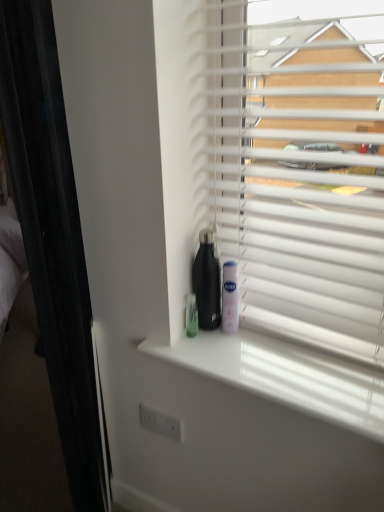
This screenshot has height=512, width=384. I want to click on vacant space in front of black matte water bottle at center, so click(212, 351).